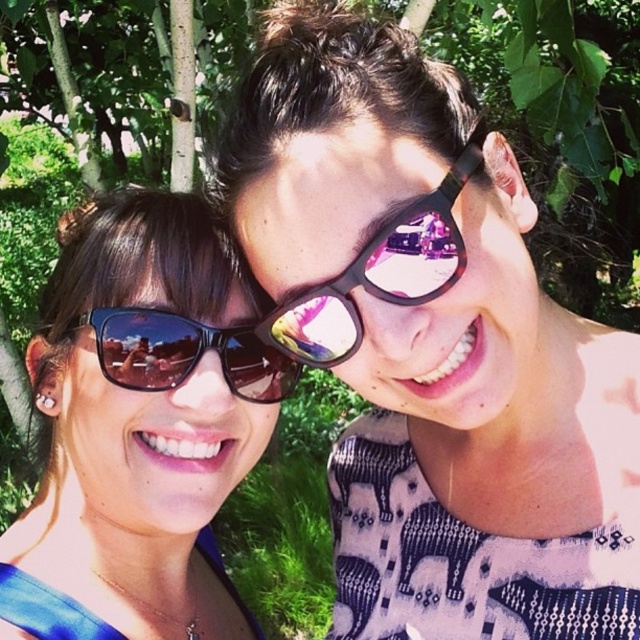
You are a photographer trying to capture both the matte black sunglasses at left and the black reflective sunglasses at center in a single frame. Which sunglasses should you focus on first to ensure they are in focus, considering their height difference?

The matte black sunglasses at left is much taller than the black reflective sunglasses at center, so you should focus on the matte black sunglasses at left first to ensure proper focus due to its greater height.

You are trying to locate the matte black sunglasses at upper right in the image. According to the coordinates provided, where exactly would you find them?

The matte black sunglasses at upper right can be found at the coordinates point [433,346].